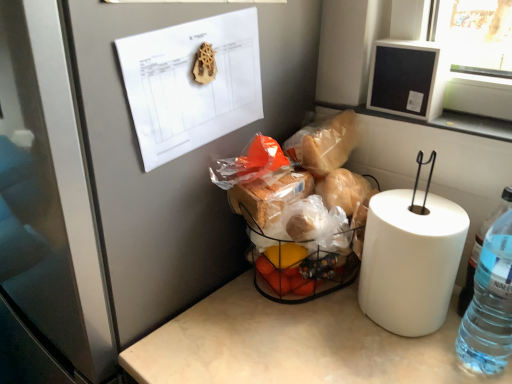
Question: Does white paper at upper left have a greater width compared to translucent plastic basket at center?

Choices:
 (A) no
 (B) yes

Answer: (A)

Question: Does white paper at upper left have a lesser height compared to translucent plastic basket at center?

Choices:
 (A) no
 (B) yes

Answer: (B)

Question: From a real-world perspective, does white paper at upper left sit lower than translucent plastic basket at center?

Choices:
 (A) no
 (B) yes

Answer: (A)

Question: Is white paper at upper left far away from translucent plastic basket at center?

Choices:
 (A) yes
 (B) no

Answer: (B)

Question: Does white paper at upper left appear on the right side of translucent plastic basket at center?

Choices:
 (A) no
 (B) yes

Answer: (A)

Question: Which is correct: white glossy frame at upper right is inside wooden gear at upper center, or outside of it?

Choices:
 (A) outside
 (B) inside

Answer: (A)

Question: Is white glossy frame at upper right in front of or behind wooden gear at upper center in the image?

Choices:
 (A) front
 (B) behind

Answer: (B)

Question: Is white glossy frame at upper right bigger or smaller than wooden gear at upper center?

Choices:
 (A) small
 (B) big

Answer: (B)

Question: Visually, is white glossy frame at upper right positioned to the left or to the right of wooden gear at upper center?

Choices:
 (A) right
 (B) left

Answer: (A)

Question: Does point (318, 228) appear closer or farther from the camera than point (440, 124)?

Choices:
 (A) farther
 (B) closer

Answer: (B)

Question: Choose the correct answer: Is translucent plastic basket at center inside white glossy frame at upper right or outside it?

Choices:
 (A) inside
 (B) outside

Answer: (B)

Question: Considering their positions, is translucent plastic basket at center located in front of or behind white glossy frame at upper right?

Choices:
 (A) front
 (B) behind

Answer: (A)

Question: From a real-world perspective, is translucent plastic basket at center positioned above or below white glossy frame at upper right?

Choices:
 (A) below
 (B) above

Answer: (A)

Question: Based on their sizes in the image, would you say white paper at upper left is bigger or smaller than black matte frame at upper right?

Choices:
 (A) big
 (B) small

Answer: (A)

Question: Considering the positions of point (201, 109) and point (422, 87), is point (201, 109) closer or farther from the camera than point (422, 87)?

Choices:
 (A) farther
 (B) closer

Answer: (B)